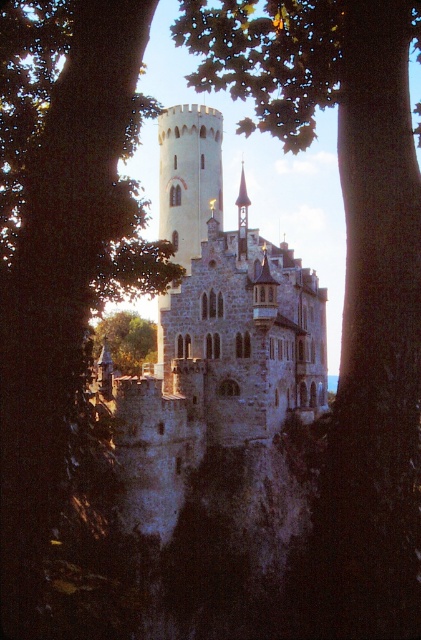
Question: Is stone castle at center positioned behind white stone tower at center?

Choices:
 (A) yes
 (B) no

Answer: (B)

Question: Among these objects, which one is farthest from the camera?

Choices:
 (A) white stone tower at center
 (B) green leafy tree at lower left
 (C) stone castle at center

Answer: (B)

Question: Does stone castle at center appear over white stone tower at center?

Choices:
 (A) no
 (B) yes

Answer: (A)

Question: Which point is closer to the camera taking this photo?

Choices:
 (A) (152, 337)
 (B) (194, 161)

Answer: (B)

Question: Observing the image, what is the correct spatial positioning of stone castle at center in reference to white stone tower at center?

Choices:
 (A) above
 (B) below

Answer: (B)

Question: Which point appears farthest from the camera in this image?

Choices:
 (A) (117, 408)
 (B) (125, 371)
 (C) (207, 170)

Answer: (B)